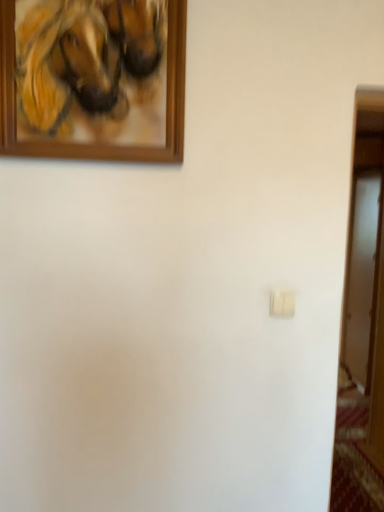
Question: Is wooden picture frame at upper left oriented away from white matte light switch at center?

Choices:
 (A) yes
 (B) no

Answer: (B)

Question: From the image's perspective, is wooden picture frame at upper left under white matte light switch at center?

Choices:
 (A) yes
 (B) no

Answer: (B)

Question: From the image's perspective, does wooden picture frame at upper left appear higher than white matte light switch at center?

Choices:
 (A) yes
 (B) no

Answer: (A)

Question: Is wooden picture frame at upper left positioned before white matte light switch at center?

Choices:
 (A) yes
 (B) no

Answer: (A)

Question: Is wooden picture frame at upper left not within white matte light switch at center?

Choices:
 (A) yes
 (B) no

Answer: (A)

Question: Does wooden picture frame at upper left lie behind white matte light switch at center?

Choices:
 (A) no
 (B) yes

Answer: (A)

Question: From a real-world perspective, does white matte light switch at center stand above wooden picture frame at upper left?

Choices:
 (A) yes
 (B) no

Answer: (B)

Question: From the image's perspective, is white matte light switch at center on top of wooden picture frame at upper left?

Choices:
 (A) yes
 (B) no

Answer: (B)

Question: Considering the relative sizes of white matte light switch at center and wooden picture frame at upper left in the image provided, is white matte light switch at center smaller than wooden picture frame at upper left?

Choices:
 (A) no
 (B) yes

Answer: (B)

Question: Can you confirm if white matte light switch at center is thinner than wooden picture frame at upper left?

Choices:
 (A) no
 (B) yes

Answer: (B)

Question: Is white matte light switch at center positioned beyond the bounds of wooden picture frame at upper left?

Choices:
 (A) no
 (B) yes

Answer: (B)

Question: Is white matte light switch at center taller than wooden picture frame at upper left?

Choices:
 (A) no
 (B) yes

Answer: (A)

Question: Would you say wooden picture frame at upper left is to the left or to the right of white matte light switch at center in the picture?

Choices:
 (A) left
 (B) right

Answer: (A)